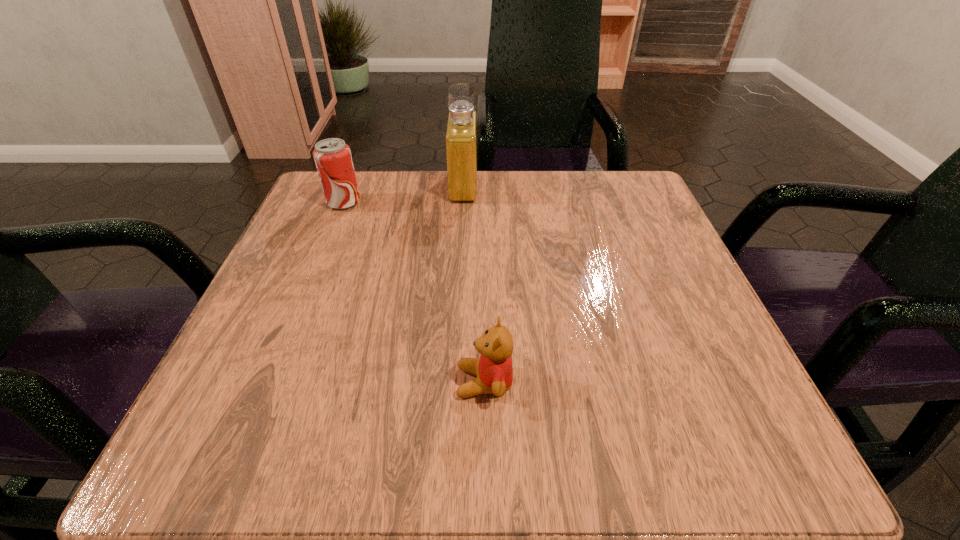
You are a GUI agent. You are given a task and a screenshot of the screen. Output one action in this format:
    pyautogui.click(x=<x>, y=<y>)
    Task: Click on the vacant area that lies between the tallest object and the second tallest object
    
    Given the screenshot: What is the action you would take?
    point(404,194)

The width and height of the screenshot is (960, 540). I want to click on vacant space that is in between the tallest object and the soda can, so click(x=404, y=194).

Where is `free area in between the perfume and the teddy bear`? free area in between the perfume and the teddy bear is located at coordinates (474, 284).

Identify which object is the second closest to the perfume. Please provide its 2D coordinates. Your answer should be formatted as a tuple, i.e. [(x, y)], where the tuple contains the x and y coordinates of a point satisfying the conditions above.

[(494, 370)]

Locate which object ranks in proximity to the tallest object. Please provide its 2D coordinates. Your answer should be formatted as a tuple, i.e. [(x, y)], where the tuple contains the x and y coordinates of a point satisfying the conditions above.

[(333, 159)]

This screenshot has width=960, height=540. Find the location of `vacant space that satisfies the following two spatial constraints: 1. on the front-facing side of the tallest object; 2. on the front side of the soda can`. vacant space that satisfies the following two spatial constraints: 1. on the front-facing side of the tallest object; 2. on the front side of the soda can is located at coordinates (463, 202).